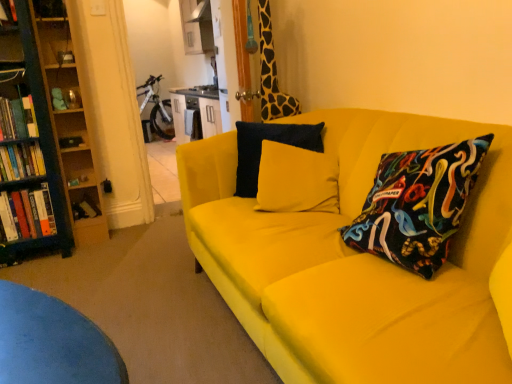
Question: From a real-world perspective, is white glossy bicycle at upper center positioned above or below wooden bookshelf at left?

Choices:
 (A) below
 (B) above

Answer: (A)

Question: From the image's perspective, relative to wooden bookshelf at left, is white glossy bicycle at upper center above or below?

Choices:
 (A) above
 (B) below

Answer: (A)

Question: Considering the real-world distances, which object is closest to the hardcover book at left, arranged as the 3th book when viewed from the top?

Choices:
 (A) white glossy bicycle at upper center
 (B) wooden bookcase at left
 (C) wooden bookshelf at left
 (D) hardcover book at left, the 1th book in the top-to-bottom sequence
 (E) giraffe-patterned fabric at upper right

Answer: (B)

Question: Which is farther from the hardcover book at lower left, the fourth book from the top?

Choices:
 (A) hardcover book at left, which ranks as the 2th book in bottom-to-top order
 (B) hardcover book at left, the 4th book ordered from the bottom
 (C) giraffe-patterned fabric at upper right
 (D) wooden bookshelf at left
 (E) yellow fabric couch at center

Answer: (E)